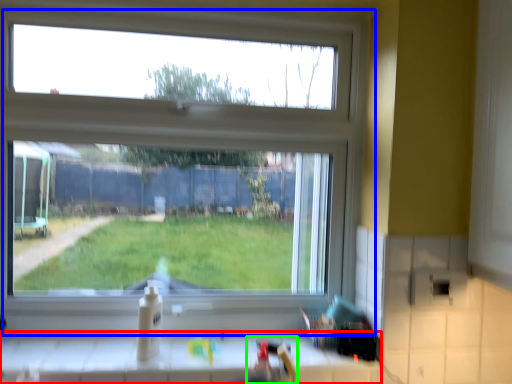
Question: Considering the real-world distances, which object is farthest from counter (highlighted by a red box)? window (highlighted by a blue box) or sink (highlighted by a green box)?

Choices:
 (A) window
 (B) sink

Answer: (A)